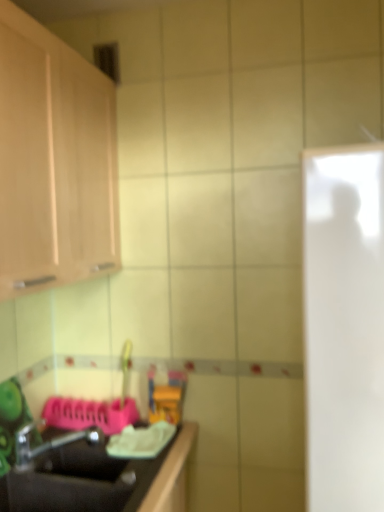
What do you see at coordinates (344, 327) in the screenshot?
I see `white glossy door at right` at bounding box center [344, 327].

The image size is (384, 512). What do you see at coordinates (54, 161) in the screenshot?
I see `light wood cabinet at upper left` at bounding box center [54, 161].

Identify the location of light wood cabinet at upper left. This screenshot has width=384, height=512. (54, 161).

Locate an element on the screen. This screenshot has width=384, height=512. white glossy door at right is located at coordinates (344, 327).

Considering the sizes of objects metallic silver faucet at lower left and light wood cabinet at upper left in the image provided, who is shorter, metallic silver faucet at lower left or light wood cabinet at upper left?

metallic silver faucet at lower left.

From the image's perspective, is metallic silver faucet at lower left beneath light wood cabinet at upper left?

Indeed, from the image's perspective, metallic silver faucet at lower left is shown beneath light wood cabinet at upper left.

The image size is (384, 512). In order to click on cabinetry in front of the metallic silver faucet at lower left in this screenshot , I will do `click(54, 161)`.

Can you confirm if white glossy door at right is thinner than black matte sink at lower left?

No.

Would you say white glossy door at right is inside or outside black matte sink at lower left?

white glossy door at right is not inside black matte sink at lower left, it's outside.

Consider the image. Who is more distant, white glossy door at right or black matte sink at lower left?

black matte sink at lower left is more distant.

Which is behind, point (11, 185) or point (15, 504)?

The point (15, 504) is farther from the camera.

From a real-world perspective, which object rests below the other?

black matte sink at lower left is physically lower.

You are a GUI agent. You are given a task and a screenshot of the screen. Output one action in this format:
    pyautogui.click(x=<x>, y=<y>)
    Task: Click on the countertop on the right of light wood cabinet at upper left
    The width and height of the screenshot is (384, 512).
    Given the screenshot: What is the action you would take?
    pyautogui.click(x=101, y=480)

Is light wood cabinet at upper left aimed at black matte sink at lower left?

No, light wood cabinet at upper left is not aimed at black matte sink at lower left.

Which is less distant, (72,440) or (369,329)?

Clearly, point (72,440) is more distant from the camera than point (369,329).

Between metallic silver faucet at lower left and white glossy door at right, which one has more height?

Standing taller between the two is white glossy door at right.

Does metallic silver faucet at lower left turn towards white glossy door at right?

Yes.

Would you say metallic silver faucet at lower left contains white glossy door at right?

No, white glossy door at right is not surrounded by metallic silver faucet at lower left.

Between metallic silver faucet at lower left and black matte sink at lower left, which one appears on the right side from the viewer's perspective?

Positioned to the right is black matte sink at lower left.

Which point is more distant from viewer, (78, 438) or (45, 489)?

Positioned behind is point (78, 438).

Where is `tap lying above the black matte sink at lower left (from the image's perspective)`? tap lying above the black matte sink at lower left (from the image's perspective) is located at coordinates (48, 443).

Is metallic silver faucet at lower left not close to black matte sink at lower left?

Actually, metallic silver faucet at lower left and black matte sink at lower left are a little close together.

Would you say white glossy door at right is a long distance from light wood cabinet at upper left?

No, there isn't a large distance between white glossy door at right and light wood cabinet at upper left.

Which of these two, white glossy door at right or light wood cabinet at upper left, is thinner?

With smaller width is light wood cabinet at upper left.

Which point is more distant from viewer, (378, 265) or (67, 149)?

Positioned behind is point (67, 149).

Is black matte sink at lower left shorter than metallic silver faucet at lower left?

In fact, black matte sink at lower left may be taller than metallic silver faucet at lower left.

Is black matte sink at lower left oriented towards metallic silver faucet at lower left?

No, black matte sink at lower left is not facing towards metallic silver faucet at lower left.

Which is less distant, (145, 482) or (29, 433)?

Point (145, 482) is closer to the camera than point (29, 433).

Is metallic silver faucet at lower left inside black matte sink at lower left?

Actually, metallic silver faucet at lower left is outside black matte sink at lower left.

Locate an element on the screen. The width and height of the screenshot is (384, 512). cabinetry in front of the metallic silver faucet at lower left is located at coordinates (54, 161).

Where is `countertop located on the left of white glossy door at right`? This screenshot has width=384, height=512. countertop located on the left of white glossy door at right is located at coordinates (101, 480).

Looking at the image, which one is located closer to white glossy door at right, black matte sink at lower left or light wood cabinet at upper left?

Among the two, black matte sink at lower left is located nearer to white glossy door at right.

Looking at this image, which object lies nearer to the anchor point black matte sink at lower left, light wood cabinet at upper left or white glossy door at right?

white glossy door at right is positioned closer to the anchor black matte sink at lower left.

Based on their spatial positions, is metallic silver faucet at lower left or white glossy door at right closer to light wood cabinet at upper left?

white glossy door at right lies closer to light wood cabinet at upper left than the other object.

From the image, which object appears to be farther from black matte sink at lower left, white glossy door at right or metallic silver faucet at lower left?

Based on the image, white glossy door at right appears to be further to black matte sink at lower left.

When comparing their distances from white glossy door at right, does metallic silver faucet at lower left or black matte sink at lower left seem further?

Based on the image, metallic silver faucet at lower left appears to be further to white glossy door at right.

Estimate the real-world distances between objects in this image. Which object is closer to light wood cabinet at upper left, black matte sink at lower left or white glossy door at right?

Based on the image, white glossy door at right appears to be nearer to light wood cabinet at upper left.

Which object lies nearer to the anchor point white glossy door at right, black matte sink at lower left or metallic silver faucet at lower left?

black matte sink at lower left lies closer to white glossy door at right than the other object.

When comparing their distances from black matte sink at lower left, does metallic silver faucet at lower left or white glossy door at right seem closer?

Among the two, metallic silver faucet at lower left is located nearer to black matte sink at lower left.

The width and height of the screenshot is (384, 512). I want to click on tap situated between light wood cabinet at upper left and white glossy door at right from left to right, so click(x=48, y=443).

Locate an element on the screen. This screenshot has width=384, height=512. tap between light wood cabinet at upper left and black matte sink at lower left from top to bottom is located at coordinates (48, 443).

Identify the location of glass door between light wood cabinet at upper left and black matte sink at lower left in the up-down direction. (344, 327).

Where is `countertop between metallic silver faucet at lower left and white glossy door at right from left to right`? The image size is (384, 512). countertop between metallic silver faucet at lower left and white glossy door at right from left to right is located at coordinates (101, 480).